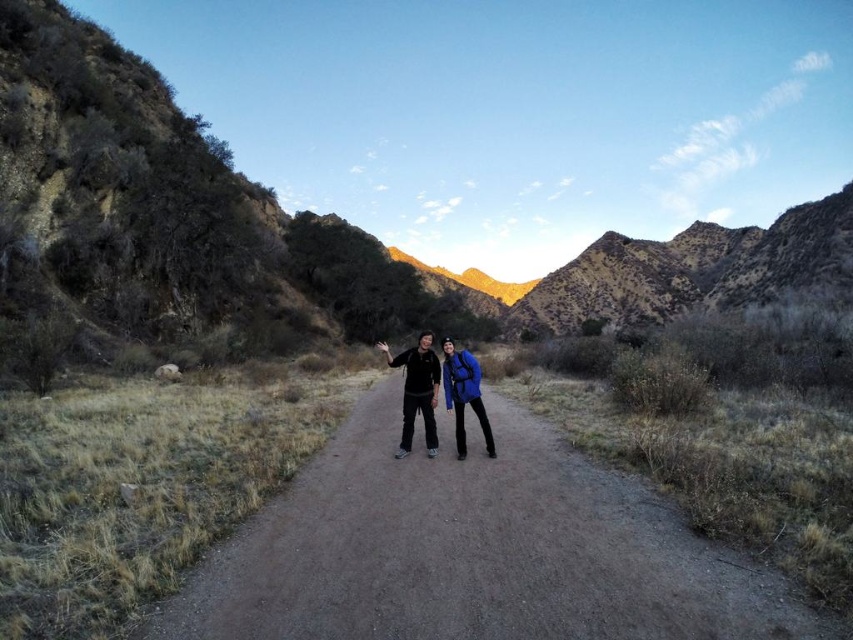
Question: Is matte black jacket at center smaller than blue fabric backpack at center?

Choices:
 (A) yes
 (B) no

Answer: (B)

Question: Is brown dirt track at center bigger than blue fabric backpack at center?

Choices:
 (A) yes
 (B) no

Answer: (A)

Question: Which is nearer to the matte black jacket at center?

Choices:
 (A) brown rocky mountain at center
 (B) blue fabric backpack at center
 (C) brown dirt track at center

Answer: (B)

Question: Estimate the real-world distances between objects in this image. Which object is farther from the blue fabric backpack at center?

Choices:
 (A) matte black jacket at center
 (B) brown rocky mountain at center
 (C) brown dirt track at center

Answer: (B)

Question: Which object appears closest to the camera in this image?

Choices:
 (A) blue fabric backpack at center
 (B) matte black jacket at center
 (C) brown rocky mountain at center
 (D) brown dirt track at center

Answer: (D)

Question: Does matte black jacket at center appear on the right side of blue fabric backpack at center?

Choices:
 (A) yes
 (B) no

Answer: (B)